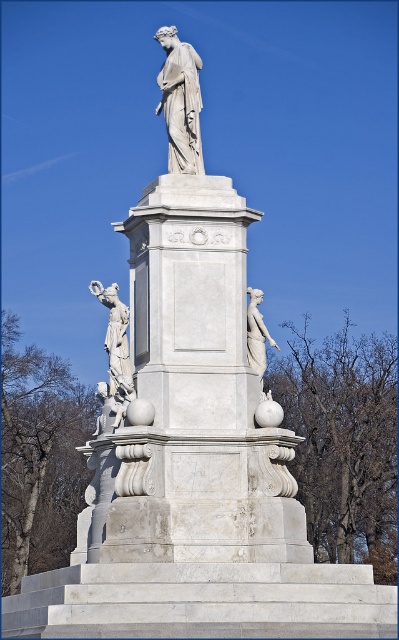
You are an art student analyzing the monument. You notice the white marble statue at center and the white marble statue at left. Which one is taller?

The white marble statue at center is much taller than the white marble statue at left.

You are a tour guide leading a group around the monument. You want to point out the distance between the two statues to your visitors. How far apart are the white marble statue at center and the white marble statue at left?

The white marble statue at center and the white marble statue at left are 14.13 meters apart.